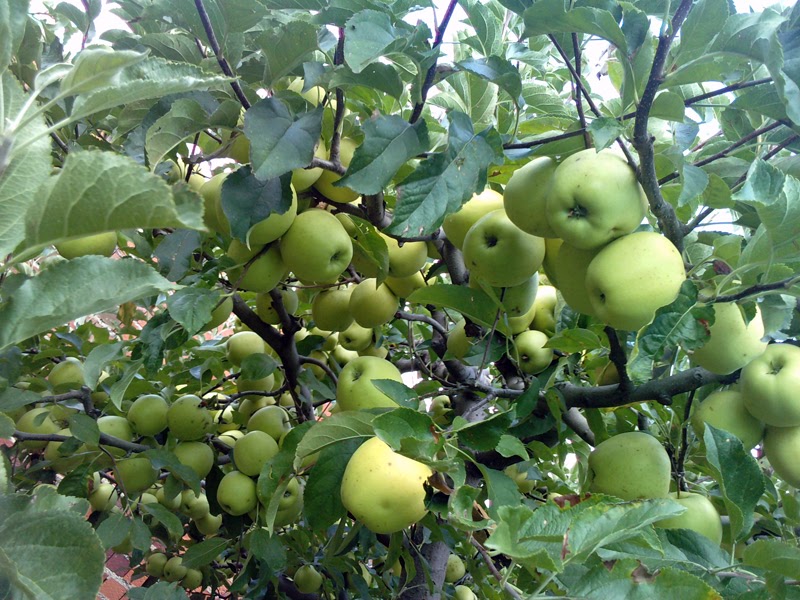
I want to click on brick wall, so click(x=130, y=574).